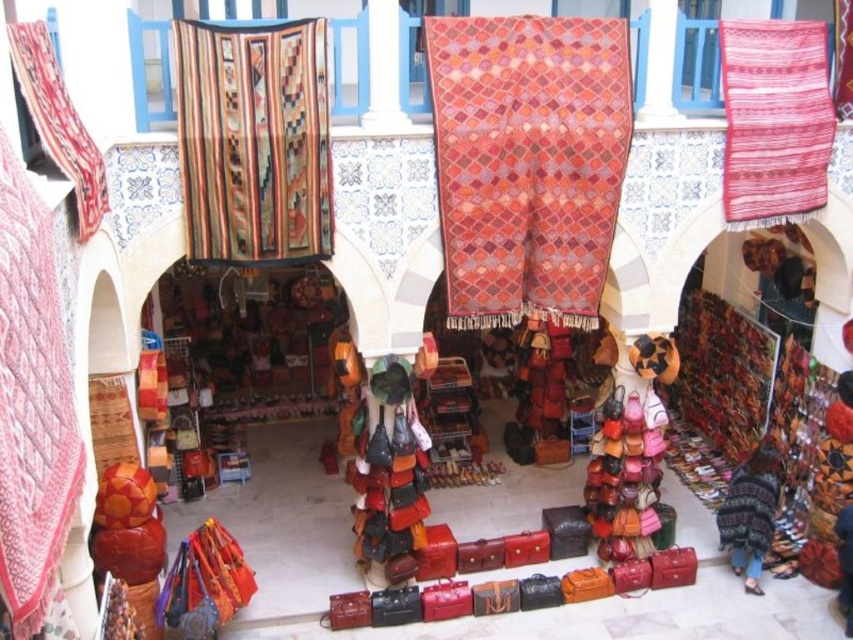
Question: Based on their relative distances, which object is farther from the red woven rug at upper left?

Choices:
 (A) quilted pink fabric at left
 (B) multicolored woven rug at upper left
 (C) textured woolen rug at center

Answer: (C)

Question: Is quilted pink fabric at left below woven fabric rug at upper right?

Choices:
 (A) yes
 (B) no

Answer: (A)

Question: Which point appears farthest from the camera in this image?

Choices:
 (A) (305, 170)
 (B) (547, 257)

Answer: (B)

Question: Where is textured woolen rug at center located in relation to red woven rug at upper left in the image?

Choices:
 (A) above
 (B) below

Answer: (A)

Question: Is multicolored woven rug at upper left in front of woven fabric rug at upper right?

Choices:
 (A) yes
 (B) no

Answer: (A)

Question: Estimate the real-world distances between objects in this image. Which object is farther from the multicolored woven rug at upper left?

Choices:
 (A) quilted pink fabric at left
 (B) woven fabric rug at upper right

Answer: (B)